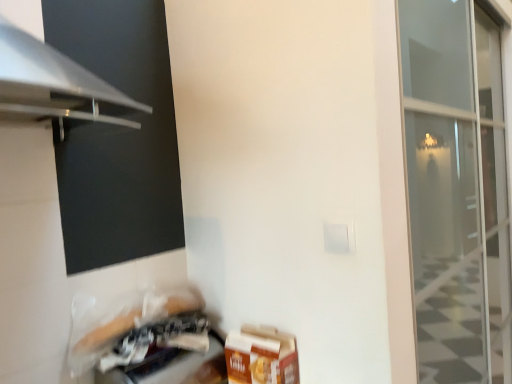
Question: Is brown cardboard box at lower right closer to the viewer compared to plastic bag at lower left?

Choices:
 (A) yes
 (B) no

Answer: (B)

Question: Does brown cardboard box at lower right have a smaller size compared to plastic bag at lower left?

Choices:
 (A) no
 (B) yes

Answer: (B)

Question: Can you confirm if brown cardboard box at lower right is shorter than plastic bag at lower left?

Choices:
 (A) no
 (B) yes

Answer: (A)

Question: Is brown cardboard box at lower right directly adjacent to plastic bag at lower left?

Choices:
 (A) no
 (B) yes

Answer: (A)

Question: Would you say brown cardboard box at lower right is a long distance from plastic bag at lower left?

Choices:
 (A) no
 (B) yes

Answer: (A)

Question: From a real-world perspective, is brown cardboard box at lower right physically below plastic bag at lower left?

Choices:
 (A) yes
 (B) no

Answer: (B)

Question: Considering the relative positions of black matte screen at lower left and plastic bag at lower left in the image provided, is black matte screen at lower left to the right of plastic bag at lower left from the viewer's perspective?

Choices:
 (A) no
 (B) yes

Answer: (A)

Question: Does black matte screen at lower left contain plastic bag at lower left?

Choices:
 (A) no
 (B) yes

Answer: (A)

Question: From a real-world perspective, is black matte screen at lower left over plastic bag at lower left?

Choices:
 (A) yes
 (B) no

Answer: (A)

Question: From the image's perspective, is black matte screen at lower left below plastic bag at lower left?

Choices:
 (A) yes
 (B) no

Answer: (B)

Question: Is black matte screen at lower left positioned in front of plastic bag at lower left?

Choices:
 (A) no
 (B) yes

Answer: (B)

Question: From the image's perspective, is black matte screen at lower left over plastic bag at lower left?

Choices:
 (A) yes
 (B) no

Answer: (A)

Question: Is black matte screen at lower left at the right side of brown cardboard box at lower right?

Choices:
 (A) no
 (B) yes

Answer: (A)